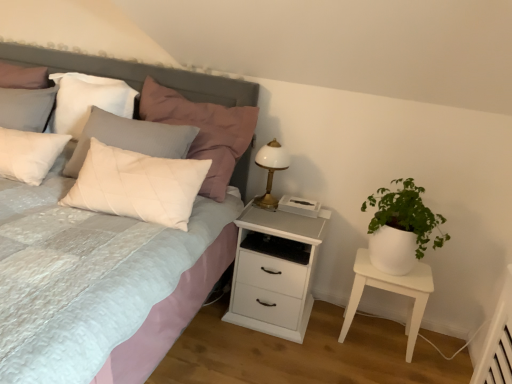
Where is `empty space that is to the right of white matte nightstand at center`? This screenshot has width=512, height=384. empty space that is to the right of white matte nightstand at center is located at coordinates (338, 337).